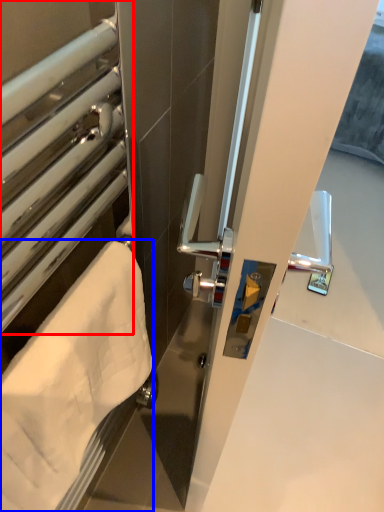
Question: Among these objects, which one is nearest to the camera, window (highlighted by a red box) or towel (highlighted by a blue box)?

Choices:
 (A) window
 (B) towel

Answer: (A)